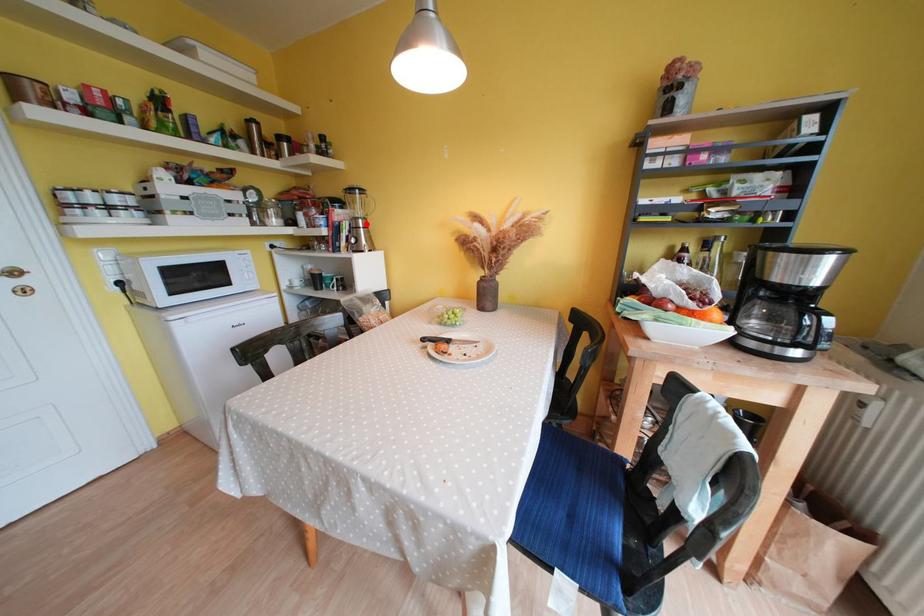
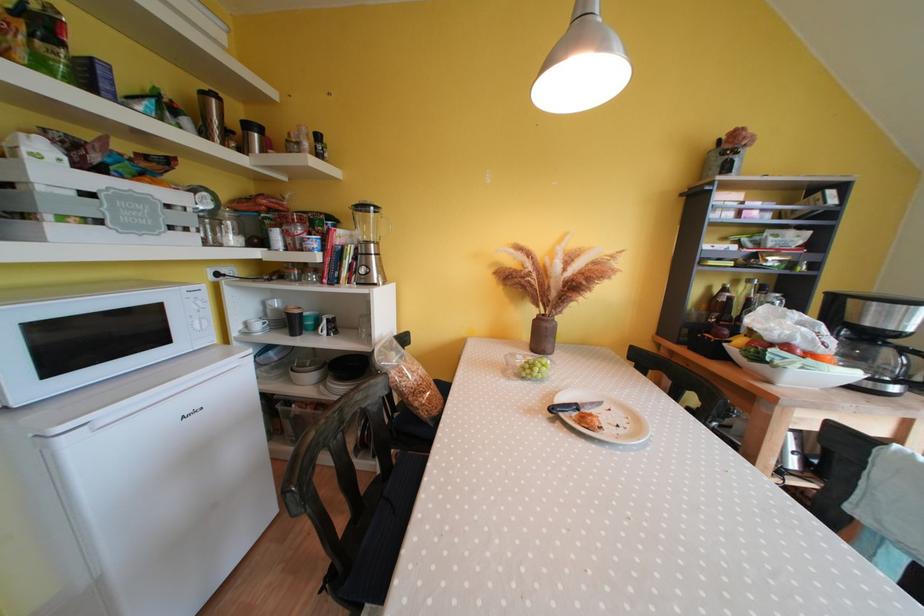
Locate, in the second image, the point that corresponds to the highlighted location in the first image.

(379, 249)